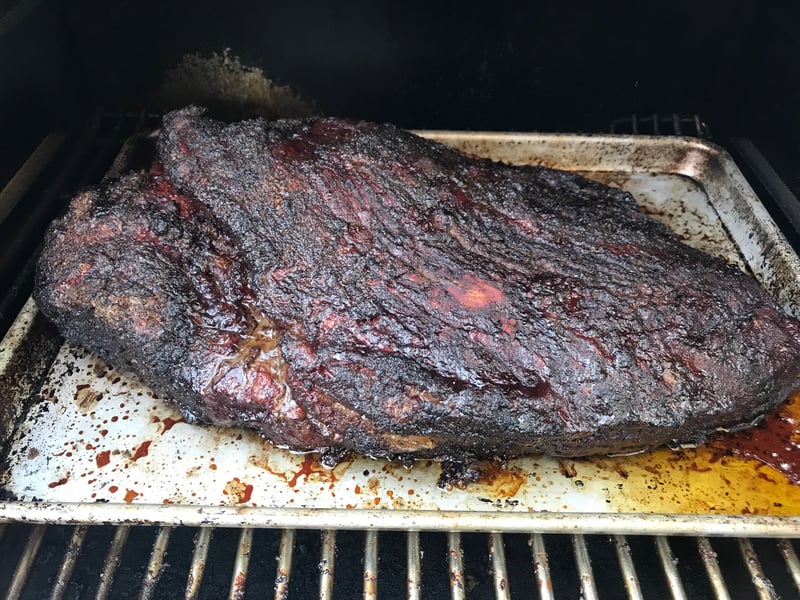
Where is `bottom of tray`? bottom of tray is located at coordinates (190, 435).